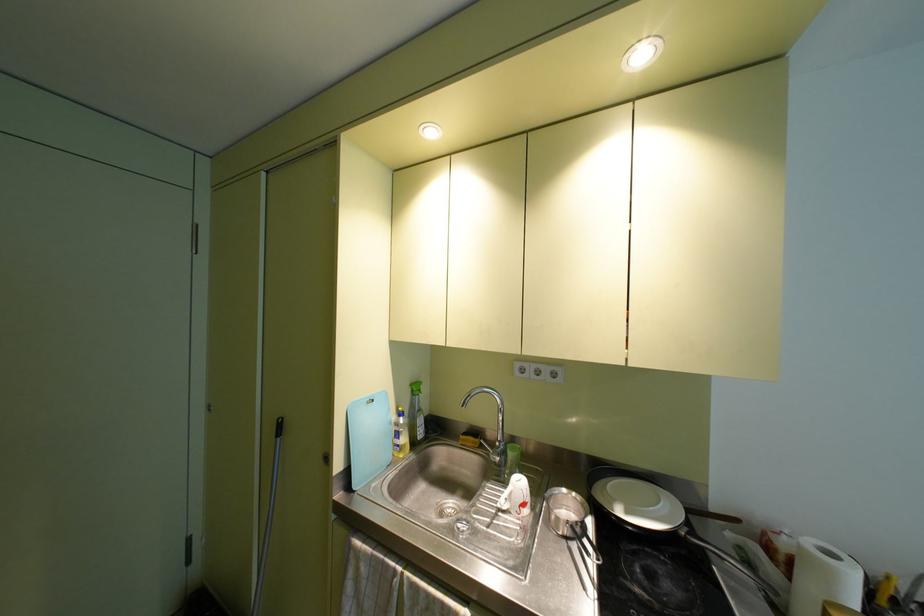
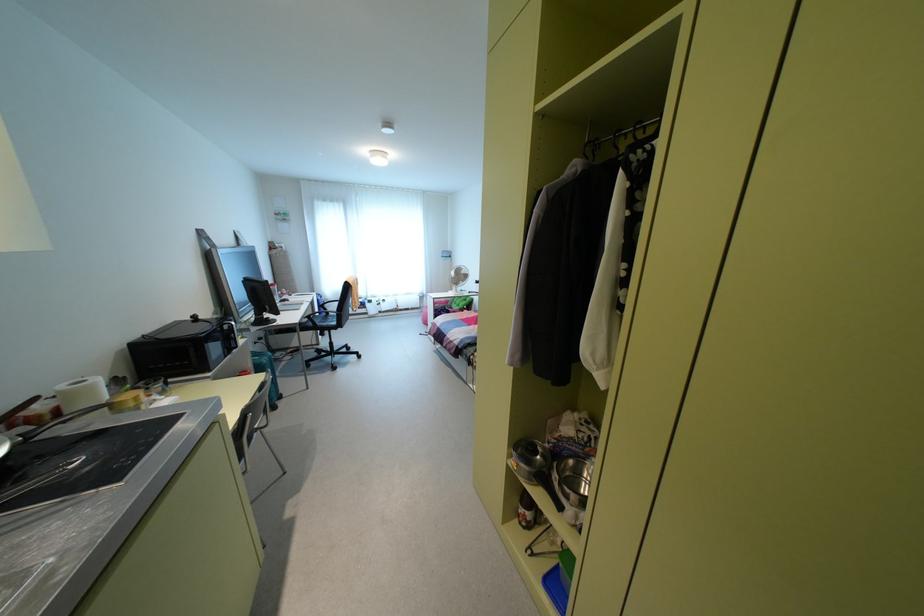
Where in the second image is the point corresponding to (807,541) from the first image?

(62, 387)